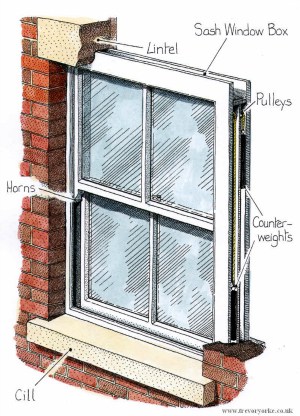
The height and width of the screenshot is (416, 300). What are the coordinates of `right bottom window pane` in the screenshot? It's located at (191, 285).